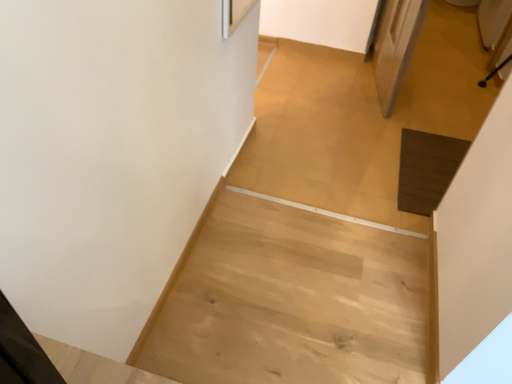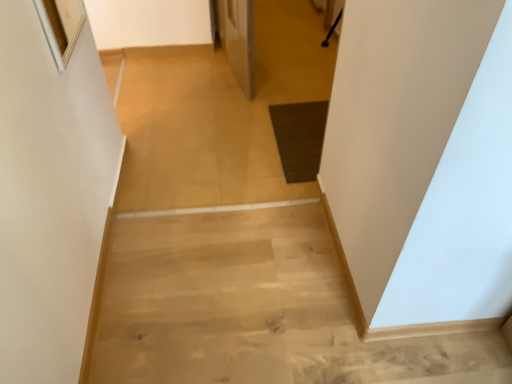
Question: Which way did the camera rotate in the video?

Choices:
 (A) rotated left
 (B) rotated right

Answer: (B)